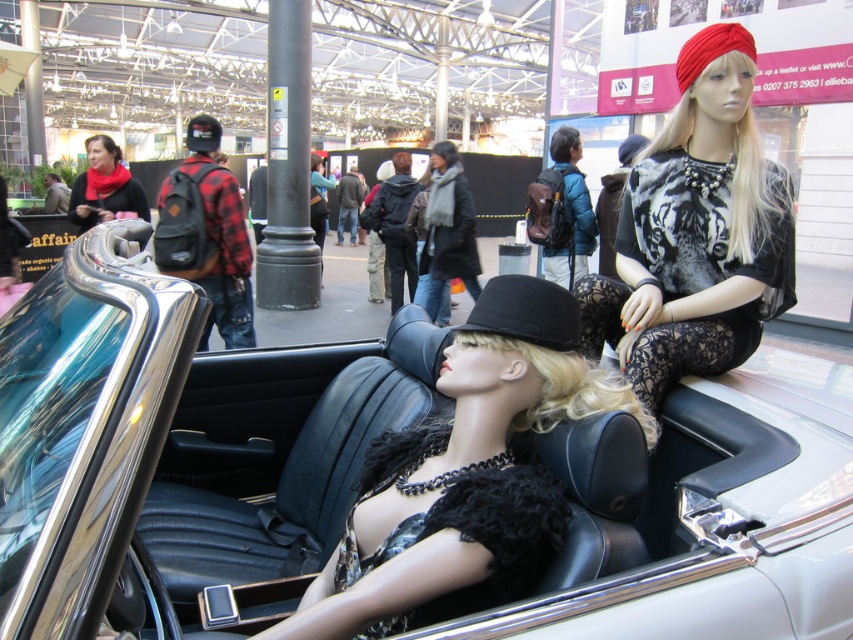
You are a delivery person who needs to place a small package between the matte black coat at center and the matte red scarf at upper left. Can you fit the package in the space between them?

The distance between the matte black coat at center and the matte red scarf at upper left is 10.47 feet, so yes, the package can be placed between them as there is sufficient space.

You are a fashion designer who wants to showcase the matte black coat at center and the matte red scarf at upper left in a magazine layout. Based on their positions in the image, which item should be placed higher up in the layout to maintain visual consistency with the original scene?

The matte red scarf at upper left should be placed higher up in the layout since it is positioned above the matte black coat at center in the original scene.

You are a fashion designer observing a mannequin display in a mall. You notice the matte black coat at center and the matte red scarf at upper left. Which item is placed to the right of the other?

The matte black coat at center is positioned on the right side of the matte red scarf at upper left.